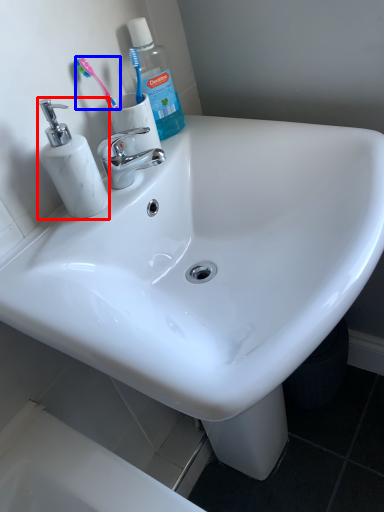
Question: Which object is further to the camera taking this photo, soap dispenser (highlighted by a red box) or toothbrush (highlighted by a blue box)?

Choices:
 (A) soap dispenser
 (B) toothbrush

Answer: (B)